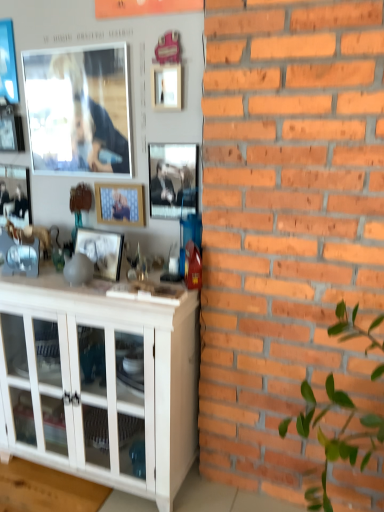
This screenshot has height=512, width=384. What do you see at coordinates (166, 86) in the screenshot?
I see `pink matte picture frame at upper center, placed as the second picture frame when sorted from right to left` at bounding box center [166, 86].

Find the location of `matte black picture frame at left, which is counted as the 7th picture frame, starting from the right`. matte black picture frame at left, which is counted as the 7th picture frame, starting from the right is located at coordinates (15, 195).

Locate an element on the screen. matte glass picture frame at upper left, which is counted as the 4th picture frame, starting from the left is located at coordinates (79, 110).

Measure the distance between point (110, 50) and camera.

The depth of point (110, 50) is 1.70 meters.

This screenshot has width=384, height=512. Find the location of `metallic silver picture frame at center, which is counted as the eighth picture frame, starting from the left`. metallic silver picture frame at center, which is counted as the eighth picture frame, starting from the left is located at coordinates coord(173,180).

What is the approximate width of metallic silver picture frame at upper left, positioned as the 3th picture frame in left-to-right order?

metallic silver picture frame at upper left, positioned as the 3th picture frame in left-to-right order, is 1.97 inches in width.

What do you see at coordinates (11, 130) in the screenshot? I see `metallic silver picture frame at upper left, positioned as the 3th picture frame in left-to-right order` at bounding box center [11, 130].

Where is `pink matte picture frame at upper center, placed as the second picture frame when sorted from right to left`? This screenshot has width=384, height=512. pink matte picture frame at upper center, placed as the second picture frame when sorted from right to left is located at coordinates (166, 86).

What's the angular difference between metallic silver picture frame at upper left, positioned as the 3th picture frame in left-to-right order, and matte glass picture frame at upper left, which is counted as the 4th picture frame, starting from the left,'s facing directions?

0.1 degrees.

Is metallic silver picture frame at upper left, positioned as the 3th picture frame in left-to-right order, oriented away from matte glass picture frame at upper left, which is counted as the 4th picture frame, starting from the left?

No, metallic silver picture frame at upper left, positioned as the 3th picture frame in left-to-right order, is not facing away from matte glass picture frame at upper left, which is counted as the 4th picture frame, starting from the left.

Considering the sizes of objects metallic silver picture frame at upper left, the sixth picture frame in the right-to-left sequence, and matte glass picture frame at upper left, which is counted as the 4th picture frame, starting from the left, in the image provided, who is shorter, metallic silver picture frame at upper left, the sixth picture frame in the right-to-left sequence, or matte glass picture frame at upper left, which is counted as the 4th picture frame, starting from the left,?

metallic silver picture frame at upper left, the sixth picture frame in the right-to-left sequence.

Is white glossy cabinet at lower left bigger than metallic silver picture frame at upper left, positioned as the 3th picture frame in left-to-right order?

Yes, white glossy cabinet at lower left is bigger than metallic silver picture frame at upper left, positioned as the 3th picture frame in left-to-right order.

Considering the relative sizes of white glossy cabinet at lower left and metallic silver picture frame at upper left, the sixth picture frame in the right-to-left sequence, in the image provided, is white glossy cabinet at lower left thinner than metallic silver picture frame at upper left, the sixth picture frame in the right-to-left sequence,?

In fact, white glossy cabinet at lower left might be wider than metallic silver picture frame at upper left, the sixth picture frame in the right-to-left sequence.

Based on the photo, does white glossy cabinet at lower left turn towards metallic silver picture frame at upper left, the sixth picture frame in the right-to-left sequence?

No, white glossy cabinet at lower left does not turn towards metallic silver picture frame at upper left, the sixth picture frame in the right-to-left sequence.

From the image's perspective, relative to metallic silver picture frame at upper left, positioned as the 3th picture frame in left-to-right order, is white glossy cabinet at lower left above or below?

white glossy cabinet at lower left is situated lower than metallic silver picture frame at upper left, positioned as the 3th picture frame in left-to-right order, in the image.

Which is nearer, (105, 334) or (90, 103)?

Point (105, 334) is closer to the camera than point (90, 103).

Considering the relative sizes of white glossy cabinet at lower left and matte glass picture frame at upper left, which appears as the 5th picture frame when viewed from the right, in the image provided, is white glossy cabinet at lower left taller than matte glass picture frame at upper left, which appears as the 5th picture frame when viewed from the right,?

Indeed, white glossy cabinet at lower left has a greater height compared to matte glass picture frame at upper left, which appears as the 5th picture frame when viewed from the right.

Is white glossy cabinet at lower left not within matte glass picture frame at upper left, which appears as the 5th picture frame when viewed from the right?

Yes, white glossy cabinet at lower left is not within matte glass picture frame at upper left, which appears as the 5th picture frame when viewed from the right.

Considering the sizes of objects white glossy cabinet at lower left and matte glass picture frame at upper left, which appears as the 5th picture frame when viewed from the right, in the image provided, who is thinner, white glossy cabinet at lower left or matte glass picture frame at upper left, which appears as the 5th picture frame when viewed from the right,?

With smaller width is matte glass picture frame at upper left, which appears as the 5th picture frame when viewed from the right.

Looking at the image, does metallic silver picture frame at upper left, the sixth picture frame in the right-to-left sequence, seem bigger or smaller compared to metallic silver picture frame at center, which is counted as the eighth picture frame, starting from the left?

Clearly, metallic silver picture frame at upper left, the sixth picture frame in the right-to-left sequence, is larger in size than metallic silver picture frame at center, which is counted as the eighth picture frame, starting from the left.

How much distance is there between metallic silver picture frame at upper left, the sixth picture frame in the right-to-left sequence, and metallic silver picture frame at center, which is counted as the eighth picture frame, starting from the left?

metallic silver picture frame at upper left, the sixth picture frame in the right-to-left sequence, is 29.83 inches from metallic silver picture frame at center, which is counted as the eighth picture frame, starting from the left.

The height and width of the screenshot is (512, 384). Find the location of `the 3rd picture frame behind the metallic silver picture frame at center, positioned as the first picture frame in right-to-left order, starting your count from the anchor`. the 3rd picture frame behind the metallic silver picture frame at center, positioned as the first picture frame in right-to-left order, starting your count from the anchor is located at coordinates (11, 130).

Is metallic silver picture frame at upper left, the sixth picture frame in the right-to-left sequence, oriented towards metallic silver picture frame at center, positioned as the first picture frame in right-to-left order?

No, metallic silver picture frame at upper left, the sixth picture frame in the right-to-left sequence, is not turned towards metallic silver picture frame at center, positioned as the first picture frame in right-to-left order.

Visually, is white glossy cabinet at lower left positioned to the left or to the right of metallic silver picture frame at center, which is counted as the eighth picture frame, starting from the left?

In the image, white glossy cabinet at lower left appears on the left side of metallic silver picture frame at center, which is counted as the eighth picture frame, starting from the left.

Considering the sizes of white glossy cabinet at lower left and metallic silver picture frame at center, positioned as the first picture frame in right-to-left order, in the image, is white glossy cabinet at lower left taller or shorter than metallic silver picture frame at center, positioned as the first picture frame in right-to-left order,?

white glossy cabinet at lower left is taller than metallic silver picture frame at center, positioned as the first picture frame in right-to-left order.

In terms of size, does white glossy cabinet at lower left appear bigger or smaller than metallic silver picture frame at center, positioned as the first picture frame in right-to-left order?

Clearly, white glossy cabinet at lower left is larger in size than metallic silver picture frame at center, positioned as the first picture frame in right-to-left order.

Is white glossy cabinet at lower left beside metallic silver picture frame at center, which is counted as the eighth picture frame, starting from the left?

No, white glossy cabinet at lower left is not in contact with metallic silver picture frame at center, which is counted as the eighth picture frame, starting from the left.

From a real-world perspective, is pink matte picture frame at upper center, arranged as the 7th picture frame when viewed from the left, below metallic blue picture frame at upper left, the first picture frame positioned from the left?

Yes.

Is pink matte picture frame at upper center, arranged as the 7th picture frame when viewed from the left, looking in the opposite direction of metallic blue picture frame at upper left, which is the eighth picture frame from right to left?

That's not correct — pink matte picture frame at upper center, arranged as the 7th picture frame when viewed from the left, is not looking away from metallic blue picture frame at upper left, which is the eighth picture frame from right to left.

Which object is closer to the camera taking this photo, pink matte picture frame at upper center, placed as the second picture frame when sorted from right to left, or metallic blue picture frame at upper left, which is the eighth picture frame from right to left?

pink matte picture frame at upper center, placed as the second picture frame when sorted from right to left, is in front.

Consider the image. Which point is more distant from viewer, (96, 78) or (20, 118)?

The point (20, 118) is farther.

Is matte glass picture frame at upper left, which appears as the 5th picture frame when viewed from the right, far from metallic silver picture frame at upper left, positioned as the 3th picture frame in left-to-right order?

No, there isn't a large distance between matte glass picture frame at upper left, which appears as the 5th picture frame when viewed from the right, and metallic silver picture frame at upper left, positioned as the 3th picture frame in left-to-right order.

Is matte glass picture frame at upper left, which appears as the 5th picture frame when viewed from the right, facing towards metallic silver picture frame at upper left, positioned as the 3th picture frame in left-to-right order?

No, matte glass picture frame at upper left, which appears as the 5th picture frame when viewed from the right, is not facing towards metallic silver picture frame at upper left, positioned as the 3th picture frame in left-to-right order.

Is metallic silver picture frame at upper left, positioned as the 3th picture frame in left-to-right order, completely or partially inside matte glass picture frame at upper left, which is counted as the 4th picture frame, starting from the left?

Actually, metallic silver picture frame at upper left, positioned as the 3th picture frame in left-to-right order, is outside matte glass picture frame at upper left, which is counted as the 4th picture frame, starting from the left.

Identify the location of the 1st picture frame directly above the metallic silver picture frame at upper left, positioned as the 3th picture frame in left-to-right order (from a real-world perspective). Image resolution: width=384 pixels, height=512 pixels. (79, 110).

You are a GUI agent. You are given a task and a screenshot of the screen. Output one action in this format:
    pyautogui.click(x=<x>, y=<y>)
    Task: Click on the cabinetry on the right of the metallic silver picture frame at upper left, the sixth picture frame in the right-to-left sequence
    Image resolution: width=384 pixels, height=512 pixels.
    Given the screenshot: What is the action you would take?
    pyautogui.click(x=101, y=380)

Considering their positions, is metallic silver picture frame at upper left, the sixth picture frame in the right-to-left sequence, positioned further to matte glass picture frame at upper left, which is counted as the 4th picture frame, starting from the left, than pink matte picture frame at upper center, arranged as the 7th picture frame when viewed from the left?

Based on the image, pink matte picture frame at upper center, arranged as the 7th picture frame when viewed from the left, appears to be further to matte glass picture frame at upper left, which is counted as the 4th picture frame, starting from the left.

Considering their positions, is metallic silver picture frame at center, which is counted as the eighth picture frame, starting from the left, positioned further to matte glass picture frame at upper left, which is counted as the 4th picture frame, starting from the left, than wooden frame at center, the 3th picture frame in the right-to-left sequence?

metallic silver picture frame at center, which is counted as the eighth picture frame, starting from the left, is further to matte glass picture frame at upper left, which is counted as the 4th picture frame, starting from the left.

When comparing their distances from metallic blue picture frame at upper left, the first picture frame positioned from the left, does pink matte picture frame at upper center, arranged as the 7th picture frame when viewed from the left, or metallic silver picture frame at upper left, the sixth picture frame in the right-to-left sequence, seem closer?

Among the two, metallic silver picture frame at upper left, the sixth picture frame in the right-to-left sequence, is located nearer to metallic blue picture frame at upper left, the first picture frame positioned from the left.

Based on their spatial positions, is white glossy cabinet at lower left or metallic silver picture frame at center, which is counted as the eighth picture frame, starting from the left, closer to metallic blue picture frame at upper left, which is the eighth picture frame from right to left?

Based on the image, metallic silver picture frame at center, which is counted as the eighth picture frame, starting from the left, appears to be nearer to metallic blue picture frame at upper left, which is the eighth picture frame from right to left.

Estimate the real-world distances between objects in this image. Which object is further from wooden frame at center, the 3th picture frame in the right-to-left sequence, matte wooden picture frame at center, marked as the fifth picture frame in a left-to-right arrangement, or metallic silver picture frame at upper left, the sixth picture frame in the right-to-left sequence?

metallic silver picture frame at upper left, the sixth picture frame in the right-to-left sequence.

Consider the image. Looking at the image, which one is located further to white glossy cabinet at lower left, pink matte picture frame at upper center, arranged as the 7th picture frame when viewed from the left, or matte black picture frame at left, which is the second picture frame in left-to-right order?

Among the two, pink matte picture frame at upper center, arranged as the 7th picture frame when viewed from the left, is located further to white glossy cabinet at lower left.

In the scene shown: Based on their spatial positions, is matte black picture frame at left, which is counted as the 7th picture frame, starting from the right, or metallic silver picture frame at upper left, the sixth picture frame in the right-to-left sequence, further from white glossy cabinet at lower left?

Among the two, metallic silver picture frame at upper left, the sixth picture frame in the right-to-left sequence, is located further to white glossy cabinet at lower left.

Estimate the real-world distances between objects in this image. Which object is closer to metallic silver picture frame at upper left, positioned as the 3th picture frame in left-to-right order, metallic blue picture frame at upper left, which is the eighth picture frame from right to left, or metallic silver picture frame at center, which is counted as the eighth picture frame, starting from the left?

metallic blue picture frame at upper left, which is the eighth picture frame from right to left, lies closer to metallic silver picture frame at upper left, positioned as the 3th picture frame in left-to-right order, than the other object.

Locate an element on the screen. picture frame located between matte black picture frame at left, which is counted as the 7th picture frame, starting from the right, and matte glass picture frame at upper left, which is counted as the 4th picture frame, starting from the left, in the left-right direction is located at coordinates (11, 130).

Where is `picture frame between wooden frame at center, the 3th picture frame in the right-to-left sequence, and white glossy cabinet at lower left, in the vertical direction`? picture frame between wooden frame at center, the 3th picture frame in the right-to-left sequence, and white glossy cabinet at lower left, in the vertical direction is located at coordinates (101, 251).